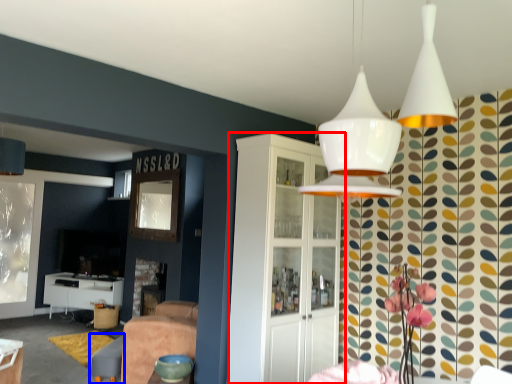
Question: Which object is further to the camera taking this photo, cabinetry (highlighted by a red box) or swivel chair (highlighted by a blue box)?

Choices:
 (A) cabinetry
 (B) swivel chair

Answer: (B)